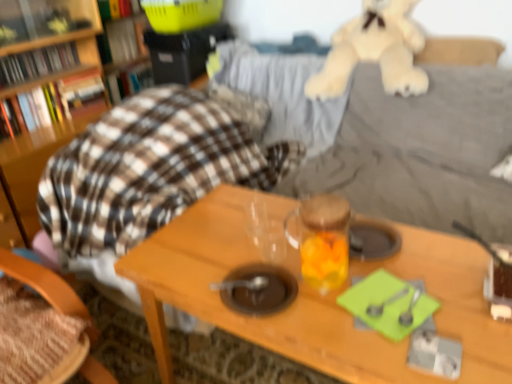
Locate an element on the screen. The height and width of the screenshot is (384, 512). free space in front of transparent glass jar at center is located at coordinates (329, 325).